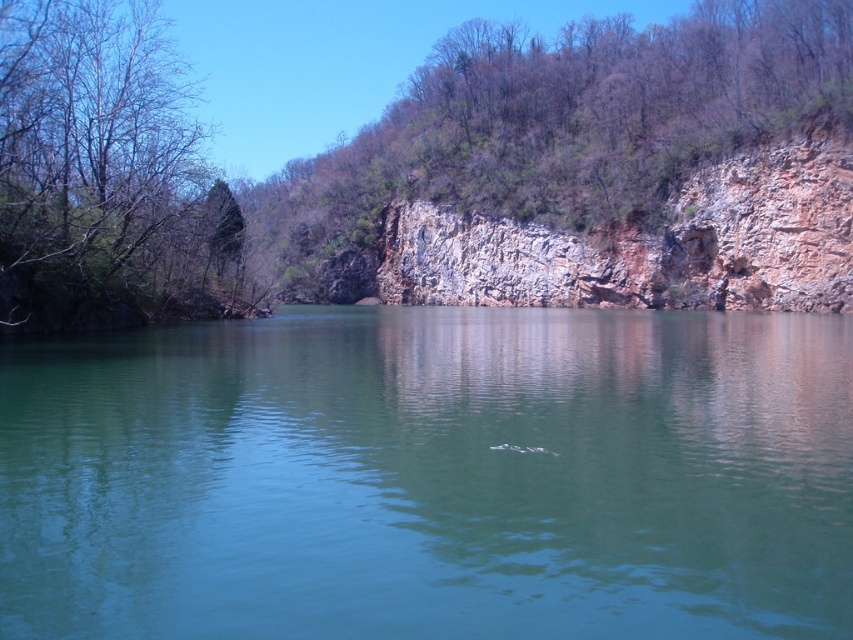
You are standing at the water edge in the scene. You see two points labeled as point (x=131, y=152) and point (x=672, y=273). Which point is nearer to you?

Point (x=131, y=152) is closer to the camera than point (x=672, y=273), so it is nearer to you.

You are standing at the edge of the cliff looking down at the green smooth water at center and the green leafy tree at left. Which object appears bigger in the scene?

The green smooth water at center appears bigger than the green leafy tree at left in the scene.

You are a hiker standing at the base of the rocky cliff at right and want to reach the green smooth water at center. Which direction should you move to get there?

You should move downward towards the green smooth water at center since it is located below the rocky cliff at right.